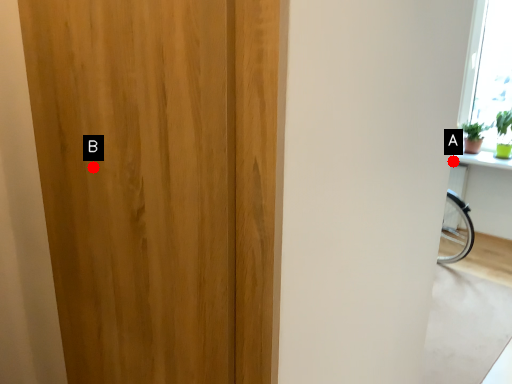
Question: Two points are circled on the image, labeled by A and B beside each circle. Among these points, which one is nearest to the camera?

Choices:
 (A) A is closer
 (B) B is closer

Answer: (B)